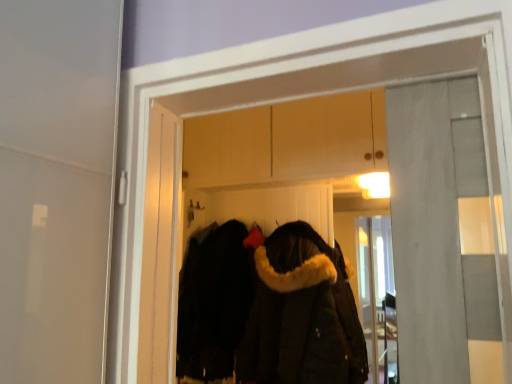
Question: Which direction should I rotate to look at black fuzzy coat at center, the 2th cloak in the right-to-left sequence?

Choices:
 (A) left
 (B) right

Answer: (A)

Question: Are black fur-lined coat at center and black fuzzy coat at center, the first cloak from the left, located far from each other?

Choices:
 (A) no
 (B) yes

Answer: (A)

Question: Is black fur-lined coat at center aimed at black fuzzy coat at center, the first cloak from the left?

Choices:
 (A) no
 (B) yes

Answer: (B)

Question: From a real-world perspective, does black fur-lined coat at center sit lower than black fuzzy coat at center, the 2th cloak in the right-to-left sequence?

Choices:
 (A) no
 (B) yes

Answer: (A)

Question: Is black fur-lined coat at center outside of black fuzzy coat at center, the 2th cloak in the right-to-left sequence?

Choices:
 (A) yes
 (B) no

Answer: (A)

Question: Is black fur-lined coat at center oriented away from black fuzzy coat at center, the 2th cloak in the right-to-left sequence?

Choices:
 (A) yes
 (B) no

Answer: (A)

Question: Is black fur-lined coat at center bigger than black fuzzy coat at center, the 2th cloak in the right-to-left sequence?

Choices:
 (A) no
 (B) yes

Answer: (B)

Question: From a real-world perspective, does black fuzzy coat at center, the first cloak from the left, stand above black fur-lined coat at center?

Choices:
 (A) no
 (B) yes

Answer: (A)

Question: Can you confirm if black fuzzy coat at center, the 2th cloak in the right-to-left sequence, is bigger than black fur-lined coat at center?

Choices:
 (A) no
 (B) yes

Answer: (A)

Question: Is black fuzzy coat at center, the 2th cloak in the right-to-left sequence, to the right of black fur-lined coat at center from the viewer's perspective?

Choices:
 (A) no
 (B) yes

Answer: (A)

Question: From the image's perspective, is black fuzzy coat at center, the first cloak from the left, above black fur-lined coat at center?

Choices:
 (A) yes
 (B) no

Answer: (B)

Question: Is black fuzzy coat at center, the 2th cloak in the right-to-left sequence, with black fur-lined coat at center?

Choices:
 (A) no
 (B) yes

Answer: (A)

Question: Can you confirm if black fuzzy coat at center, the first cloak from the left, is shorter than black fur-lined coat at center?

Choices:
 (A) yes
 (B) no

Answer: (A)

Question: Is black fuzzy coat at center, the first cloak from the left, taller than dark brown fur-lined coat at center, the 2th cloak from the left?

Choices:
 (A) yes
 (B) no

Answer: (B)